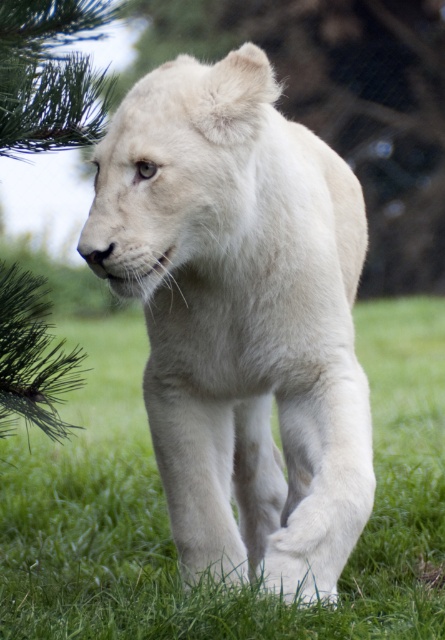
Question: Among these points, which one is nearest to the camera?

Choices:
 (A) (243, 368)
 (B) (92, 452)

Answer: (A)

Question: Observing the image, what is the correct spatial positioning of white fluffy lion at center in reference to green soft grass at center?

Choices:
 (A) below
 (B) above

Answer: (B)

Question: Does white fluffy lion at center have a lesser width compared to green soft grass at center?

Choices:
 (A) no
 (B) yes

Answer: (B)

Question: Which object appears closest to the camera in this image?

Choices:
 (A) white fluffy lion at center
 (B) green soft grass at center

Answer: (A)

Question: Does white fluffy lion at center appear over green soft grass at center?

Choices:
 (A) no
 (B) yes

Answer: (B)